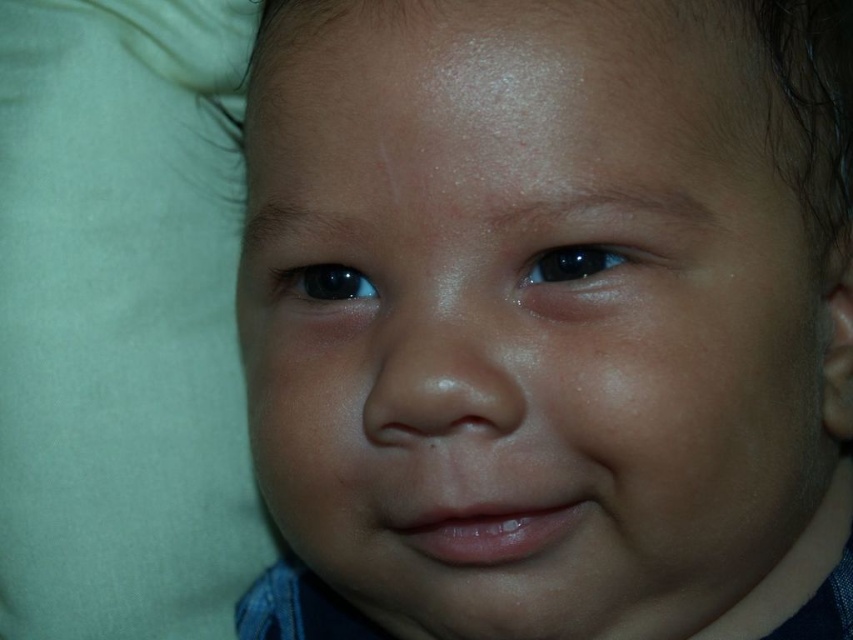
You are a pediatrician examining a baby in the image. You notice the smooth skin baby at center and the glossy black eye at upper center. Which object is closer to you?

The smooth skin baby at center is closer to the viewer than the glossy black eye at upper center.